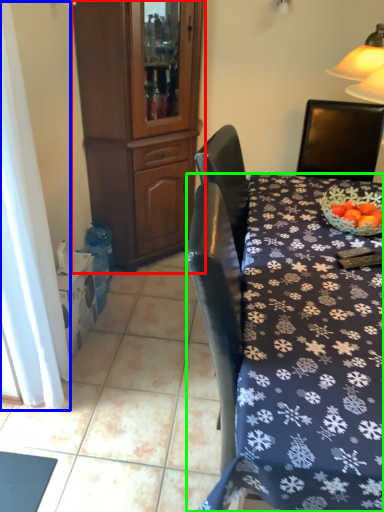
Question: Which object is the closest to the cabinetry (highlighted by a red box)? Choose among these: curtain (highlighted by a blue box) or desk (highlighted by a green box).

Choices:
 (A) curtain
 (B) desk

Answer: (A)